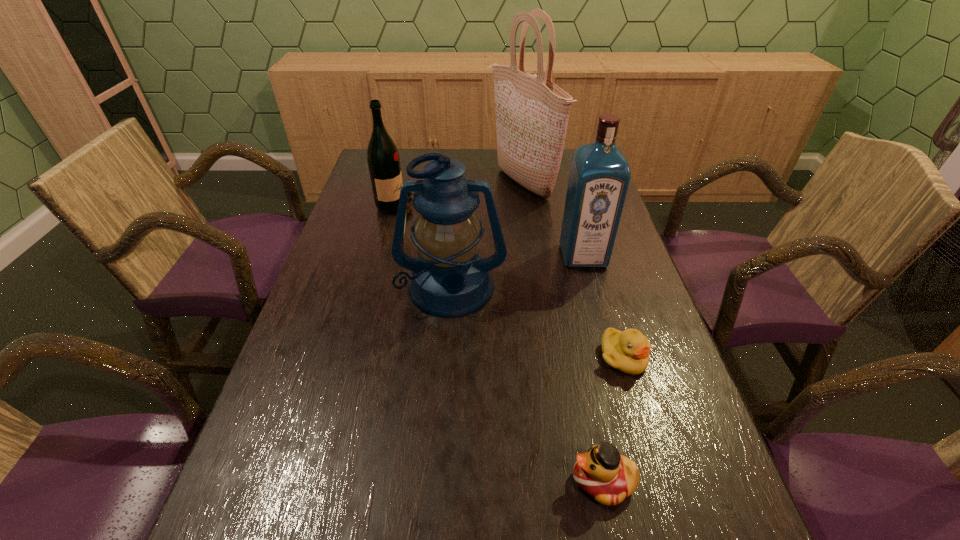
The image size is (960, 540). In order to click on free space located on the surface of the wine bottle in this screenshot , I will do `click(469, 206)`.

Where is `vacant space located 0.150m on the face of the duck`? vacant space located 0.150m on the face of the duck is located at coordinates (482, 481).

Identify the location of free space located 0.400m on the face of the duck. The height and width of the screenshot is (540, 960). (334, 481).

Image resolution: width=960 pixels, height=540 pixels. Identify the location of vacant region located 0.270m on the face of the duck. (411, 481).

Where is `free space located on the beak of the shortest object`? The width and height of the screenshot is (960, 540). free space located on the beak of the shortest object is located at coordinates (652, 453).

Identify the location of object at the far edge. (532, 113).

You are a GUI agent. You are given a task and a screenshot of the screen. Output one action in this format:
    pyautogui.click(x=<x>, y=<y>)
    Task: Click on the object positioned at the left edge
    
    Given the screenshot: What is the action you would take?
    pyautogui.click(x=383, y=159)

In order to click on shopping bag that is at the right edge in this screenshot , I will do `click(532, 113)`.

The width and height of the screenshot is (960, 540). I want to click on liquor that is positioned at the right edge, so click(599, 177).

Image resolution: width=960 pixels, height=540 pixels. What are the coordinates of `duck located in the right edge section of the desktop` in the screenshot? It's located at [x=602, y=472].